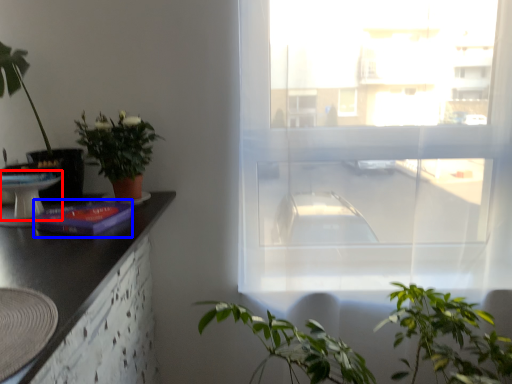
Question: Which point is further to the camera, round table (highlighted by a red box) or book (highlighted by a blue box)?

Choices:
 (A) round table
 (B) book

Answer: (A)